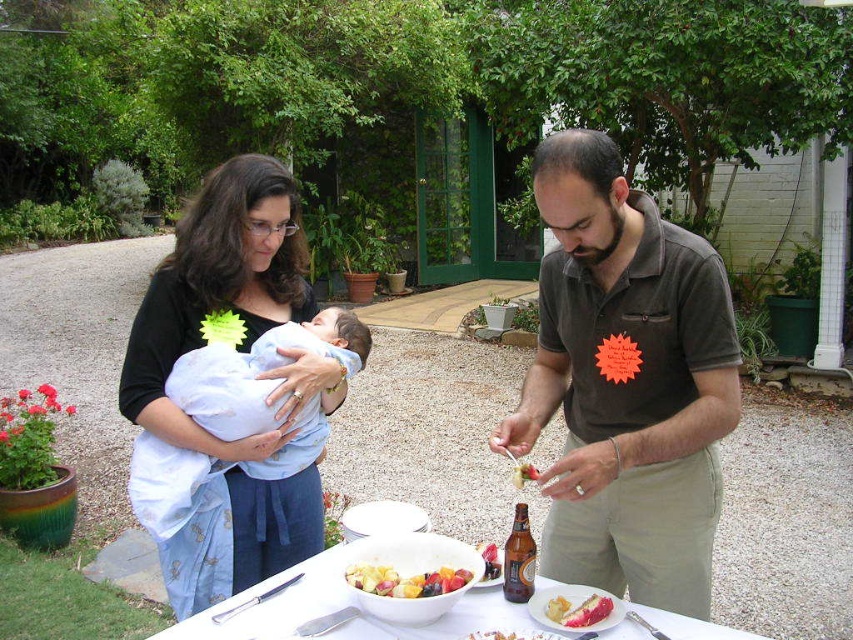
Question: Does smooth chocolate cake at center have a greater width compared to smooth white cake at center?

Choices:
 (A) no
 (B) yes

Answer: (A)

Question: Can you confirm if white ceramic bowl at center is thinner than smooth chocolate cake at center?

Choices:
 (A) yes
 (B) no

Answer: (B)

Question: In this image, where is matte black shirt at center located relative to white soft fabric baby at center?

Choices:
 (A) right
 (B) left

Answer: (B)

Question: Estimate the real-world distances between objects in this image. Which object is farther from the smooth white cake at center?

Choices:
 (A) brown cotton shirt at center
 (B) smooth pink cake at center
 (C) white ceramic bowl at center

Answer: (C)

Question: Which point is farther from the camera taking this photo?

Choices:
 (A) (322, 433)
 (B) (595, 337)

Answer: (A)

Question: Which object is the farthest from the brown cotton shirt at center?

Choices:
 (A) white soft fabric baby at center
 (B) matte brown shirt at center
 (C) glossy plastic bowl at center
 (D) smooth chocolate cake at center

Answer: (A)